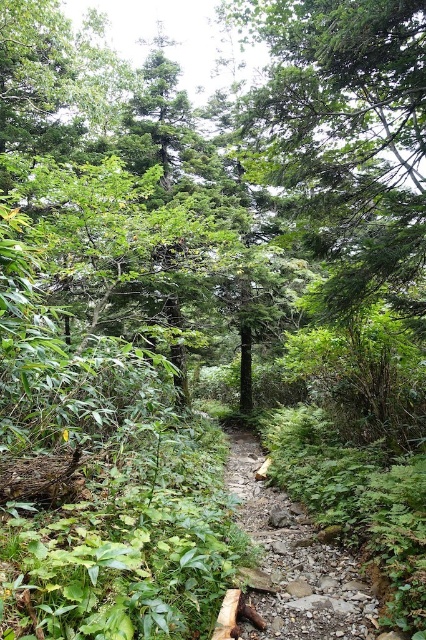
Does green leafy tree at center appear over rough stone path at center?

Correct, green leafy tree at center is located above rough stone path at center.

Is green leafy tree at center wider than rough stone path at center?

Yes.

Is point (345, 157) more distant than point (249, 532)?

Yes, point (345, 157) is behind point (249, 532).

Locate an element on the screen. The height and width of the screenshot is (640, 426). green leafy tree at center is located at coordinates (348, 134).